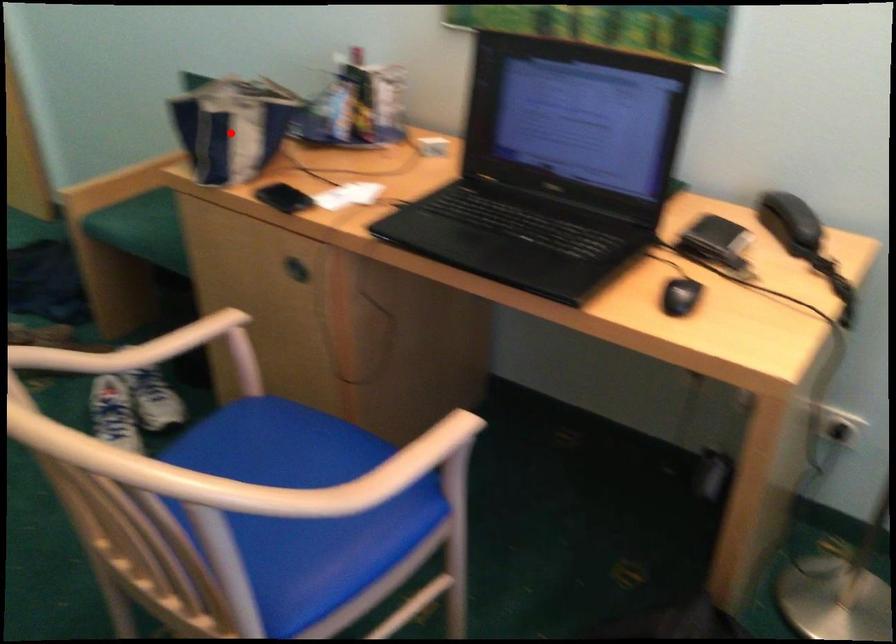
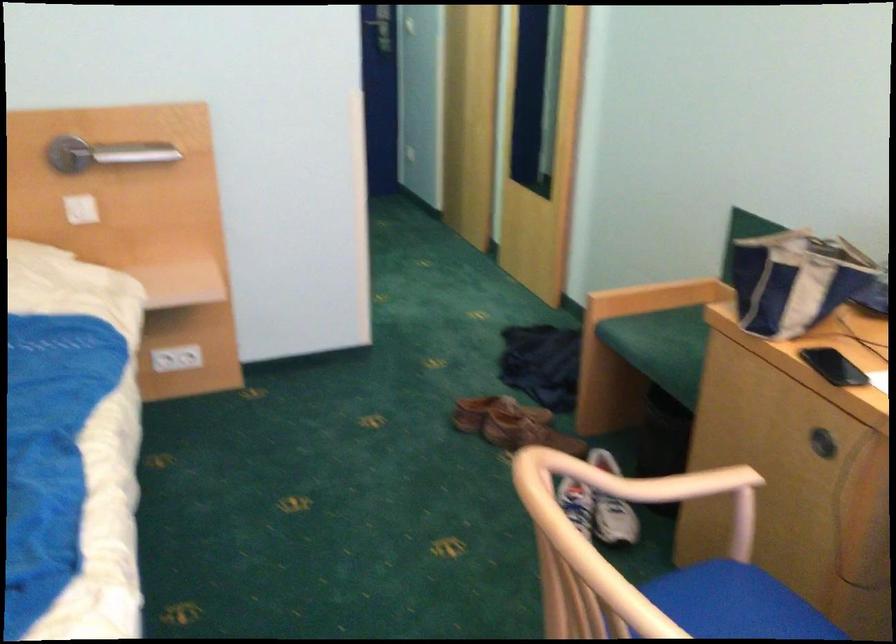
In the second image, find the point that corresponds to the highlighted location in the first image.

(794, 279)